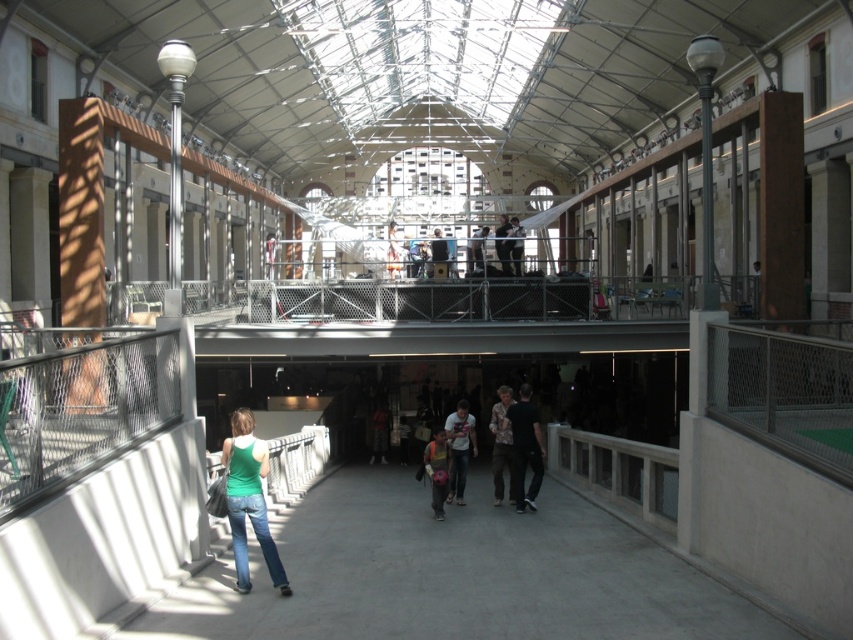
Can you confirm if concrete walkway at center is positioned below green matte shirt at lower center?

Actually, concrete walkway at center is above green matte shirt at lower center.

Between concrete walkway at center and green matte shirt at lower center, which one is positioned lower?

green matte shirt at lower center is below.

Image resolution: width=853 pixels, height=640 pixels. Describe the element at coordinates (456, 573) in the screenshot. I see `concrete walkway at center` at that location.

The height and width of the screenshot is (640, 853). Identify the location of concrete walkway at center. (456, 573).

Which is in front, point (386, 404) or point (497, 252)?

Point (497, 252) is more forward.

Does point (381, 417) come closer to viewer compared to point (509, 248)?

No, it is behind (509, 248).

Where is `dark brown leather jacket at center`? dark brown leather jacket at center is located at coordinates (379, 433).

Is point (233, 515) farther from camera compared to point (517, 230)?

No, (233, 515) is closer to viewer.

Is point (247, 451) behind point (515, 248)?

No.

I want to click on green matte shirt at lower center, so click(x=248, y=499).